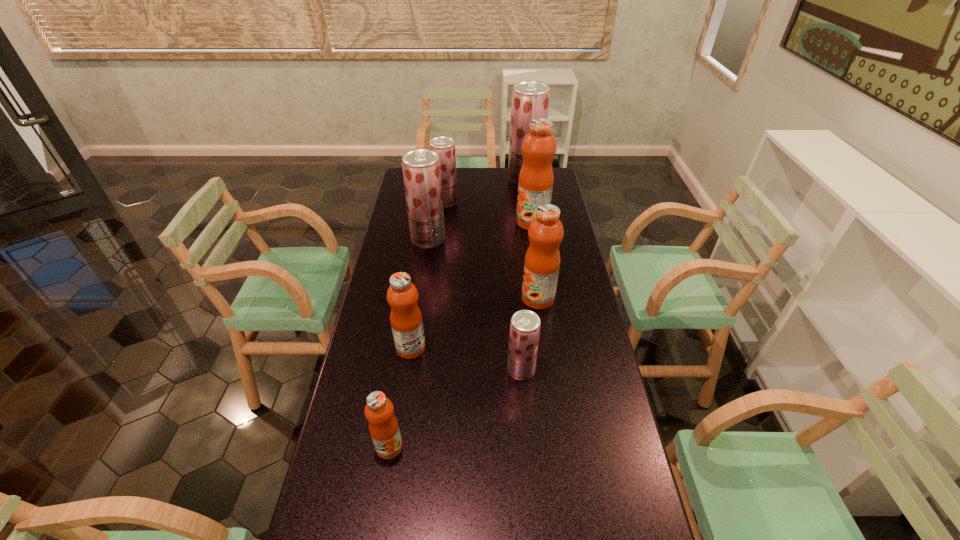
Identify the location of the farthest fruit juice. This screenshot has height=540, width=960. (530, 99).

Locate an element on the screen. The height and width of the screenshot is (540, 960). the biggest strawberry fruit juice is located at coordinates (530, 99).

What are the coordinates of `the farthest orange fruit juice` in the screenshot? It's located at (535, 185).

Locate an element on the screen. This screenshot has height=540, width=960. the third smallest strawberry fruit juice is located at coordinates (421, 169).

Where is `the second biggest orange fruit juice`? the second biggest orange fruit juice is located at coordinates (542, 261).

Identify the location of the fourth nearest fruit juice. (542, 261).

Find the location of a particular element. The width and height of the screenshot is (960, 540). the second smallest strawberry fruit juice is located at coordinates (444, 146).

The width and height of the screenshot is (960, 540). In order to click on the seventh nearest object in this screenshot , I will do `click(444, 146)`.

The height and width of the screenshot is (540, 960). Find the location of `the third biggest orange fruit juice`. the third biggest orange fruit juice is located at coordinates (406, 320).

Where is `the nearest strawberry fruit juice`? Image resolution: width=960 pixels, height=540 pixels. the nearest strawberry fruit juice is located at coordinates [525, 325].